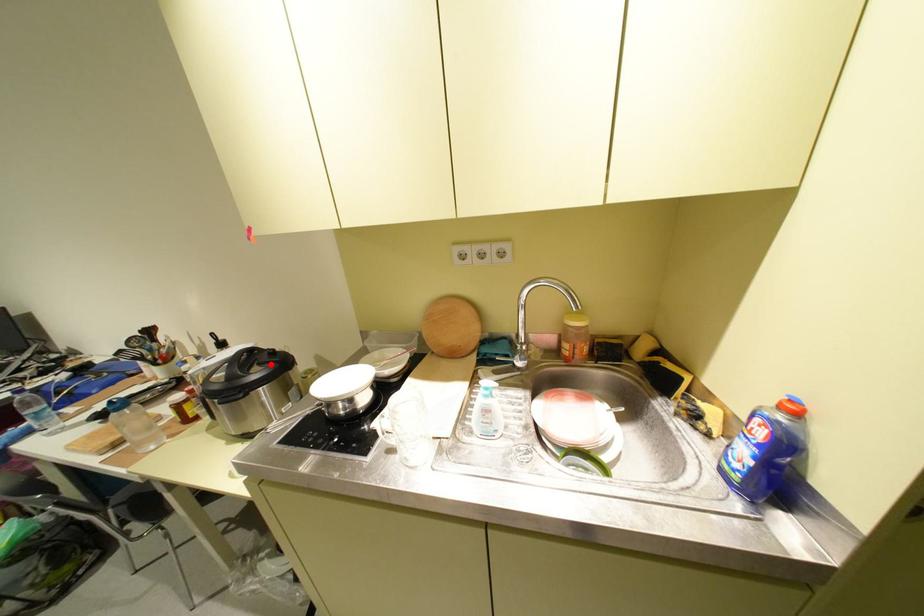
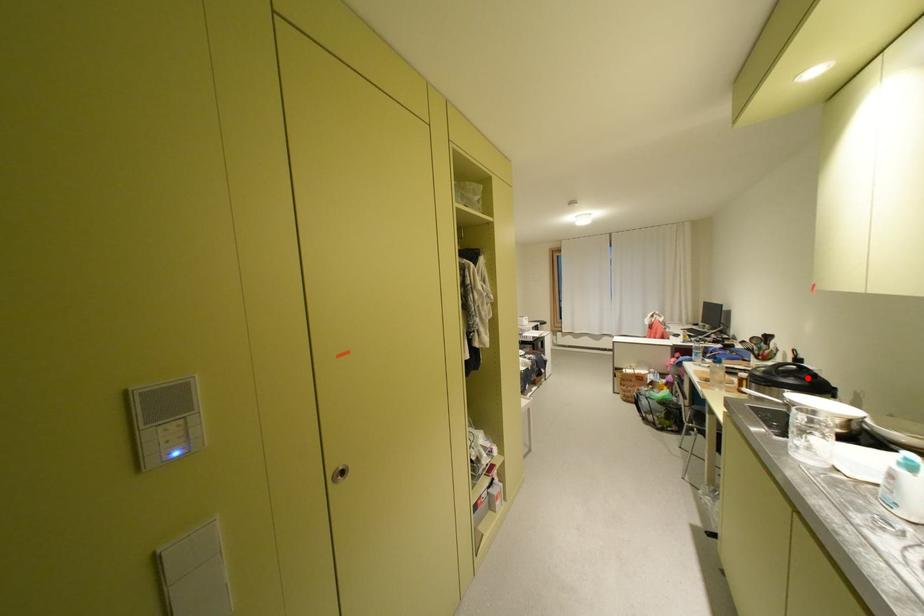
I am providing you with two images of the same scene from different viewpoints. A red point is marked on the first image and another point is marked on the second image. Does the point marked in image1 correspond to the same location as the one in image2?

Yes